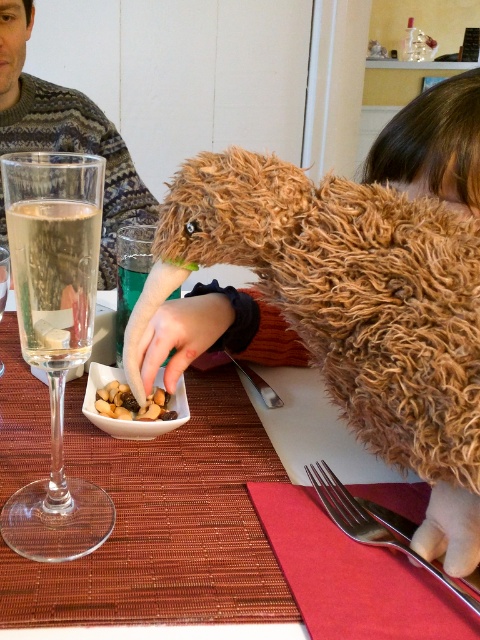
You are a guest at this table and want to reach for the shiny metallic bowl of nuts at center without knocking over the clear glass wine glass at left. Based on their positions, which object should you move first to create space?

You should move the clear glass wine glass at left first because it is closer to you than the shiny metallic bowl of nuts at center, so adjusting its position would create space without disturbing the bowl.

You are a waiter in a restaurant. You need to place a new menu on the table without moving any existing items. Where should you place it so that it doesn not interfere with the clear glass wine glass at left?

The clear glass wine glass at left is located at point (55, 336). To place the menu without interfering, position it away from this coordinate, ensuring there is enough space around the glass.